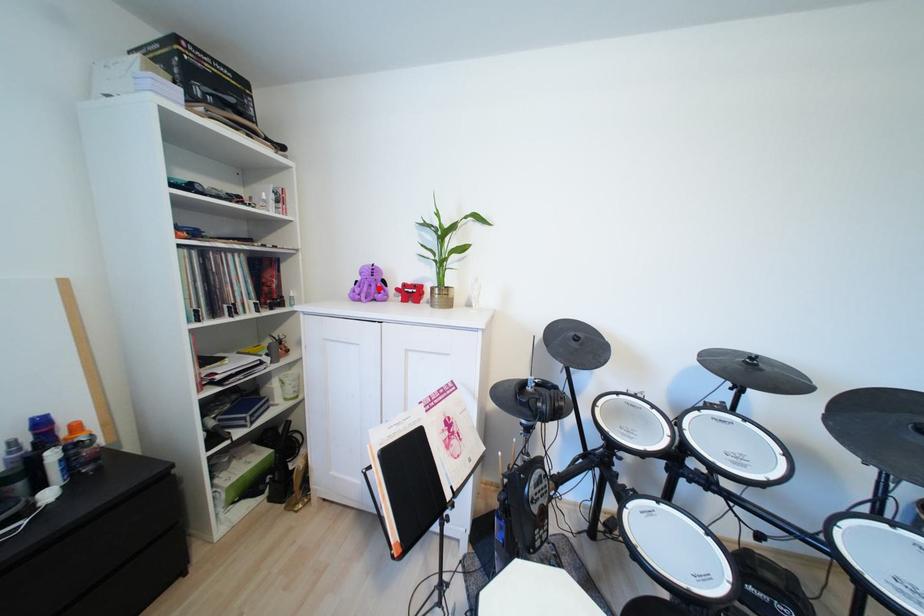
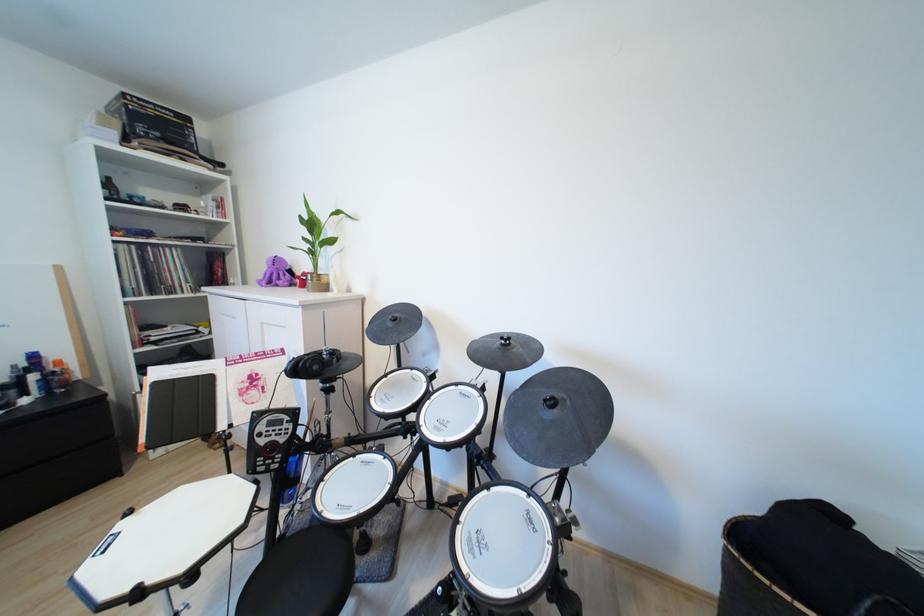
The point at the highlighted location is marked in the first image. Where is the corresponding point in the second image?

(289, 277)